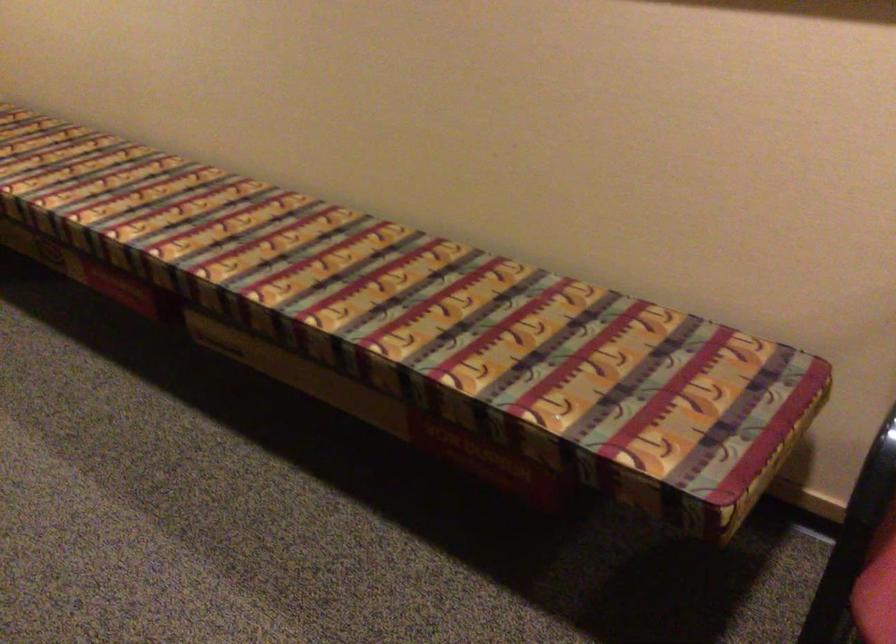
Find where to sit the patterned bench surface. Please return your answer as a coordinate pair (x, y).

(426, 315)